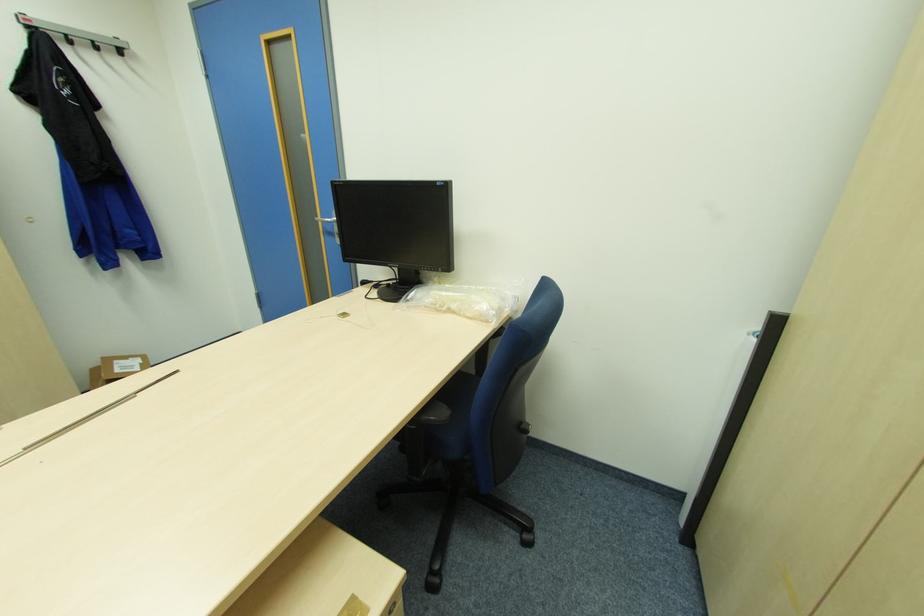
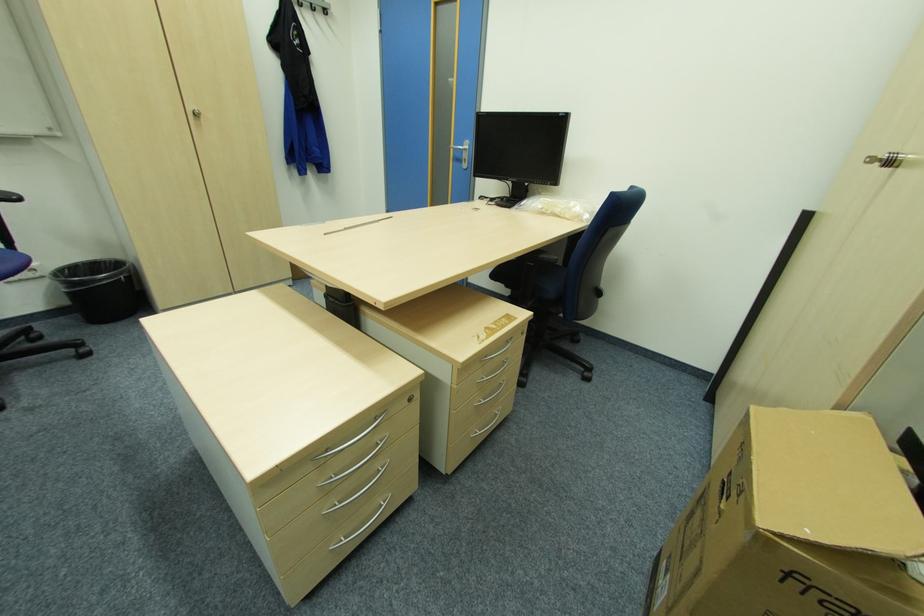
Find the pixel in the second image that matches point 338,222 in the first image.

(468, 148)